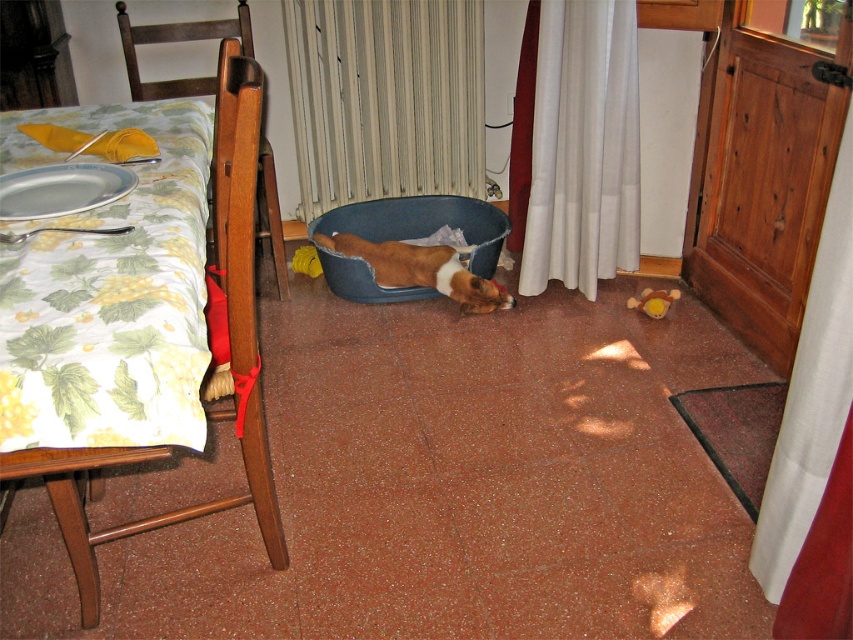
Question: In this image, where is white fabric curtain at right located relative to white fabric curtain at lower right?

Choices:
 (A) above
 (B) below

Answer: (A)

Question: Considering the real-world distances, which object is farthest from the white sheer curtain at lower right?

Choices:
 (A) white fabric curtain at center
 (B) yellow fabric table at left
 (C) white fabric curtain at right

Answer: (B)

Question: Does white fabric curtain at center have a lesser width compared to white sheer curtain at lower right?

Choices:
 (A) yes
 (B) no

Answer: (B)

Question: Does white sheer curtain at lower right appear over white fabric curtain at right?

Choices:
 (A) yes
 (B) no

Answer: (A)

Question: Which object is farther from the camera taking this photo?

Choices:
 (A) brown and white plush dog at center
 (B) white fabric curtain at right
 (C) wooden chair at left

Answer: (A)

Question: Which point is farther from the camera taking this photo?

Choices:
 (A) (405, 257)
 (B) (223, 243)
 (C) (323, 129)
 (D) (833, 465)

Answer: (C)